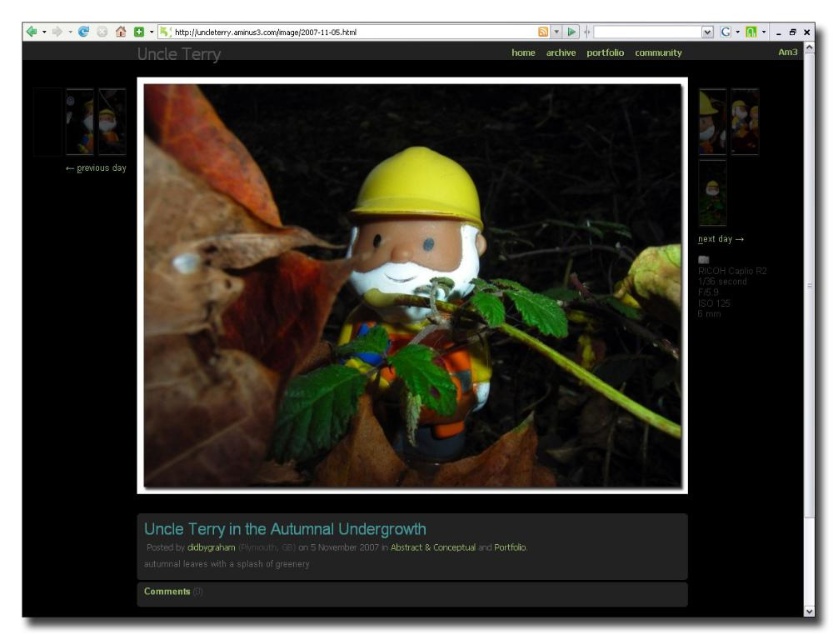
Which is in front, point (151, 449) or point (371, 227)?

Point (151, 449) is in front.

Is point (318, 285) farther from camera compared to point (463, 196)?

Yes, it is behind point (463, 196).

Measure the distance between point (270,276) and camera.

37.84 inches

Image resolution: width=838 pixels, height=640 pixels. Identify the location of green leafy plant at center. (254, 284).